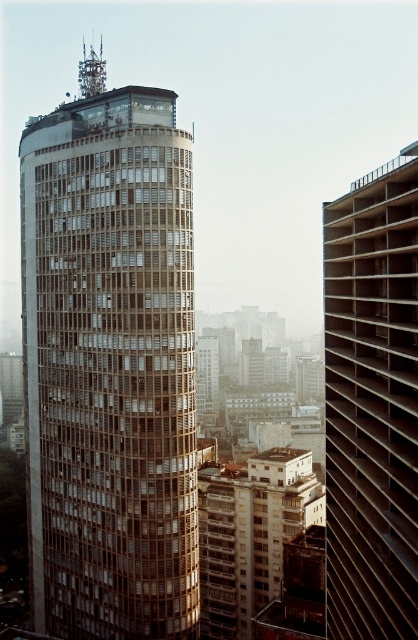
Question: Among these points, which one is nearest to the camera?

Choices:
 (A) (326, 358)
 (B) (137, 545)

Answer: (A)

Question: Can you confirm if matte brown tower at center is smaller than brown textured building at right?

Choices:
 (A) yes
 (B) no

Answer: (A)

Question: Can you confirm if matte brown tower at center is positioned below brown textured building at right?

Choices:
 (A) no
 (B) yes

Answer: (B)

Question: Can you confirm if matte brown tower at center is smaller than brown textured building at right?

Choices:
 (A) yes
 (B) no

Answer: (A)

Question: Among these points, which one is farthest from the camera?

Choices:
 (A) click(x=382, y=461)
 (B) click(x=137, y=385)

Answer: (B)